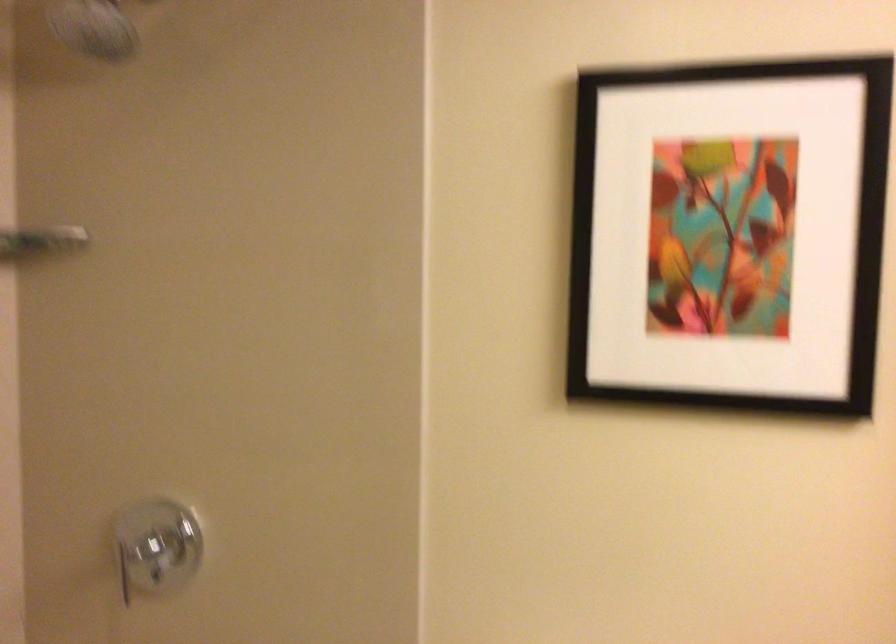
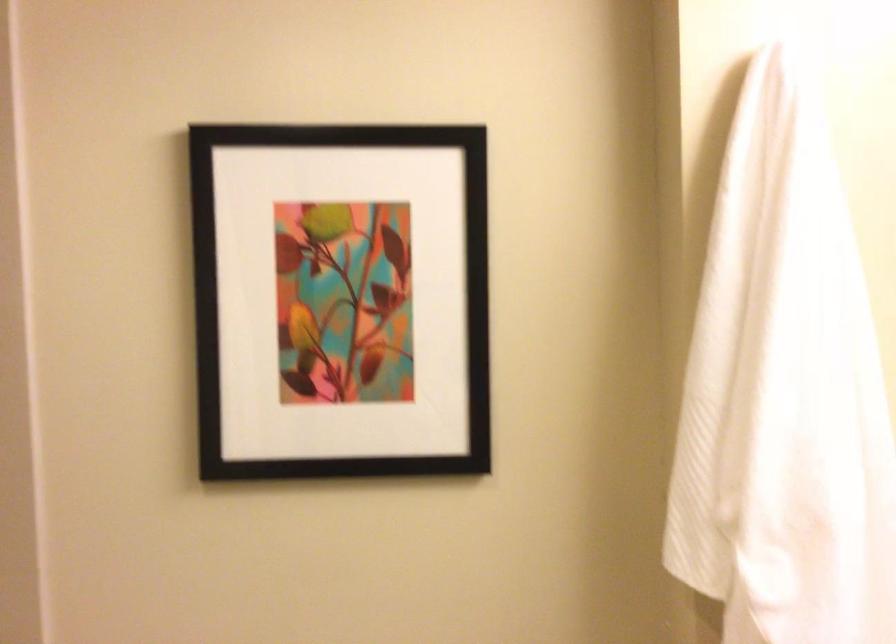
Find the pixel in the second image that matches (717,234) in the first image.

(340, 299)